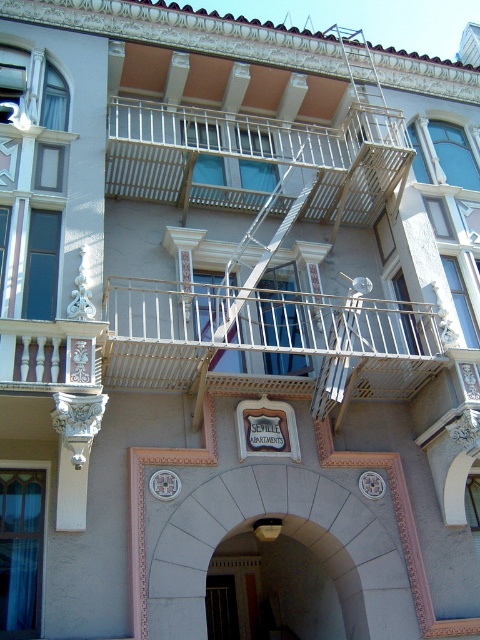
Question: Among these objects, which one is nearest to the camera?

Choices:
 (A) white metal railing at upper center
 (B) white metal railing at center

Answer: (B)

Question: Which object appears closest to the camera in this image?

Choices:
 (A) white metal railing at center
 (B) white metal railing at upper center

Answer: (A)

Question: Which point is closer to the camera?

Choices:
 (A) (409, 307)
 (B) (127, 120)

Answer: (A)

Question: Can you confirm if white metal railing at center is smaller than white metal railing at upper center?

Choices:
 (A) no
 (B) yes

Answer: (B)

Question: Can you confirm if white metal railing at center is positioned to the left of white metal railing at upper center?

Choices:
 (A) yes
 (B) no

Answer: (B)

Question: Considering the relative positions of white metal railing at center and white metal railing at upper center in the image provided, where is white metal railing at center located with respect to white metal railing at upper center?

Choices:
 (A) above
 (B) below

Answer: (B)